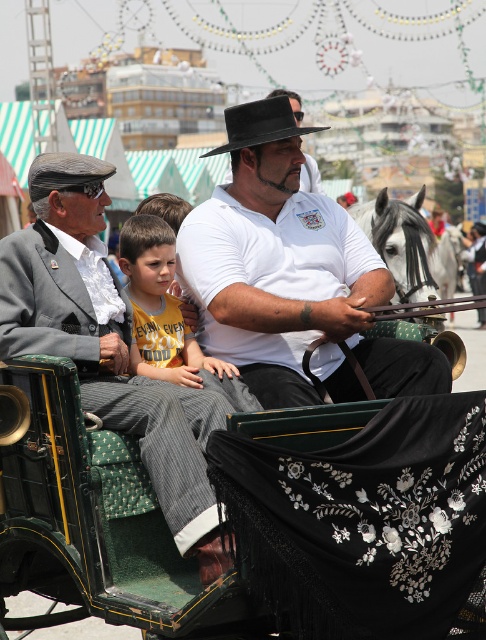
Does point (371, 218) come behind point (454, 266)?

No, it is not.

Is point (422, 296) less distant than point (445, 292)?

Yes.

Find the location of a particular element. The width and height of the screenshot is (486, 640). gray and white horse at center is located at coordinates (400, 241).

Does yellow cotton shirt at center have a greater height compared to black felt cowboy hat at center?

No.

Is point (132, 241) farther from viewer compared to point (212, 148)?

No, (132, 241) is in front of (212, 148).

What are the coordinates of `yellow cotton shirt at center` in the screenshot? It's located at (168, 317).

Is white matte shirt at center in front of black felt cowboy hat at center?

Yes, white matte shirt at center is closer to the viewer.

Is white matte shirt at center above black felt cowboy hat at center?

Actually, white matte shirt at center is below black felt cowboy hat at center.

Where is `white matte shirt at center`? The height and width of the screenshot is (640, 486). white matte shirt at center is located at coordinates (291, 275).